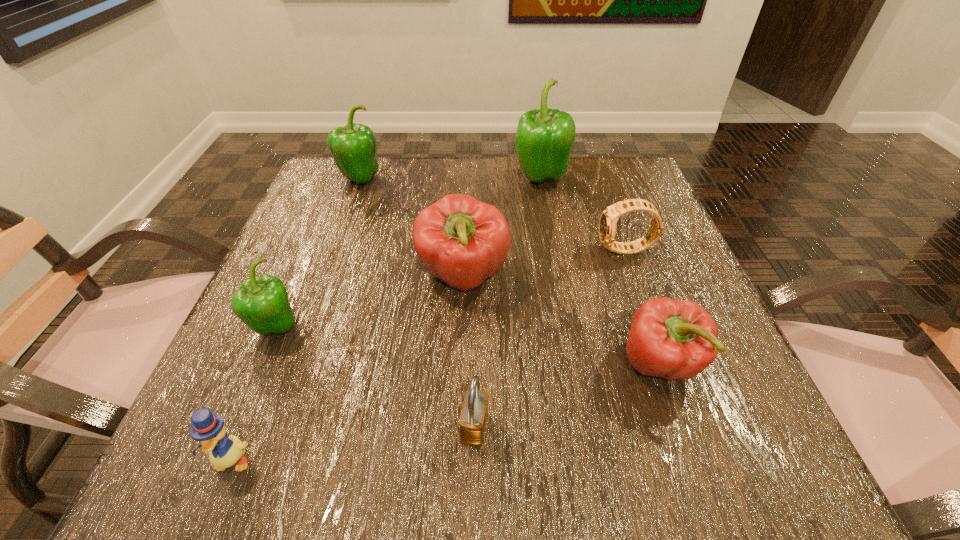
At what (x,y) coordinates should I click in order to perform the action: click on blank space at the far left corner of the desktop. Please return your answer as a coordinate pair (x, y). The width and height of the screenshot is (960, 540). Looking at the image, I should click on (376, 199).

Locate an element on the screen. This screenshot has width=960, height=540. vacant space at the near left corner of the desktop is located at coordinates (279, 465).

Image resolution: width=960 pixels, height=540 pixels. I want to click on vacant area at the far right corner of the desktop, so (640, 167).

Image resolution: width=960 pixels, height=540 pixels. In order to click on free space at the near right corner in this screenshot , I will do `click(739, 433)`.

This screenshot has height=540, width=960. What are the coordinates of `vacant region between the second biggest green bell pepper and the third bell pepper from left to right` in the screenshot? It's located at (411, 228).

Find the location of a particular element. This screenshot has width=960, height=540. free spot between the second biggest green bell pepper and the tallest object is located at coordinates (449, 179).

The height and width of the screenshot is (540, 960). I want to click on vacant region between the nearest green bell pepper and the padlock, so click(375, 378).

In order to click on free area in between the watch and the duckling in this screenshot , I will do `click(429, 355)`.

Locate an element on the screen. free space between the left pink bell pepper and the watch is located at coordinates (544, 264).

Identify the location of vacant area that lies between the bigger pink bell pepper and the black watch. This screenshot has width=960, height=540. (544, 264).